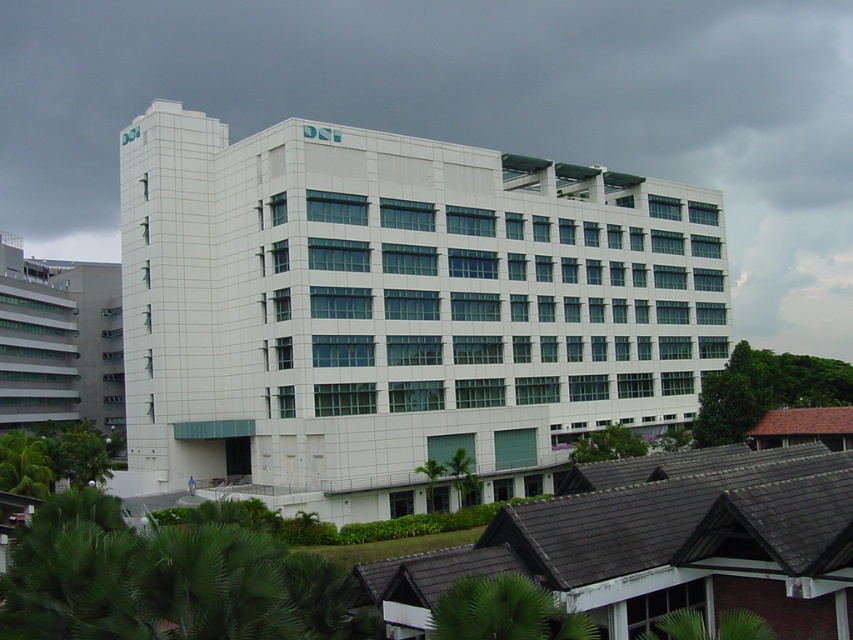
You are a delivery driver approaching the entrance of the white tile building at center and the white smooth building at left. Which building should you turn towards if you need to park in the wider parking lot adjacent to the building?

The white tile building at center is wider than the white smooth building at left, so you should turn towards the white tile building at center for the wider parking lot adjacent to it.

You are standing in front of the DSI building and want to take a photo of both the white tile building at center and the white smooth building at left. Which building should you focus on first if you want to capture both in one frame without moving your camera?

The white smooth building at left is lower than the white tile building at center, so you should focus on the white smooth building at left first to ensure both are in the frame.

Based on the photo, you are standing in front of the white tile building at center. If you want to take a photo of the entire building without any distortion, how far back should you move?

The white tile building at center is 62.81 meters away from the viewer, so you should move back to that distance to capture the entire building without distortion.